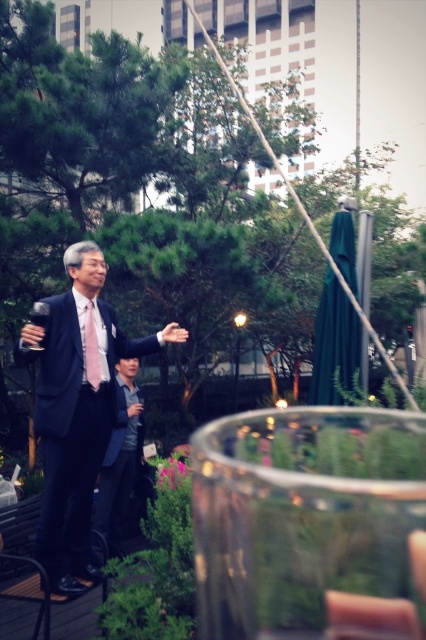
Can you confirm if matte black suit at center is taller than pink satin tie at center?

Indeed, matte black suit at center has a greater height compared to pink satin tie at center.

Does matte black suit at center have a lesser height compared to pink satin tie at center?

No.

Is point (103, 440) farther from camera compared to point (95, 333)?

Yes, point (103, 440) is behind point (95, 333).

Where is `matte black suit at center`? matte black suit at center is located at coordinates (75, 412).

Who is positioned more to the left, matte black suit at center or green fabric umbrella at upper right?

From the viewer's perspective, matte black suit at center appears more on the left side.

Between point (80, 262) and point (353, 284), which one is positioned in front?

Point (80, 262) is in front.

At what (x,y) coordinates should I click in order to perform the action: click on matte black suit at center. Please return your answer as a coordinate pair (x, y). This screenshot has height=640, width=426. Looking at the image, I should click on (75, 412).

Is point (351, 240) more distant than point (106, 468)?

Yes, it is behind point (106, 468).

Looking at this image, can you confirm if green fabric umbrella at upper right is bigger than dark gray suit at center?

Correct, green fabric umbrella at upper right is larger in size than dark gray suit at center.

Where is `green fabric umbrella at upper right`? The height and width of the screenshot is (640, 426). green fabric umbrella at upper right is located at coordinates (333, 342).